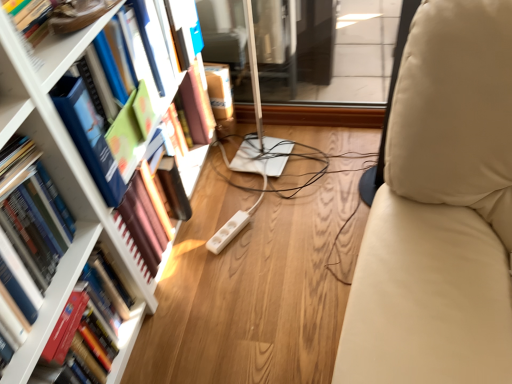
Question: Is white glossy bookshelf at upper left positioned far away from hardcover book at left, positioned as the 1th book in bottom-to-top order?

Choices:
 (A) no
 (B) yes

Answer: (A)

Question: From a real-world perspective, is white glossy bookshelf at upper left physically below hardcover book at left, positioned as the 1th book in bottom-to-top order?

Choices:
 (A) yes
 (B) no

Answer: (B)

Question: Can you confirm if white glossy bookshelf at upper left is shorter than hardcover book at left, the 3th book in the top-to-bottom sequence?

Choices:
 (A) no
 (B) yes

Answer: (B)

Question: Can you confirm if white glossy bookshelf at upper left is wider than hardcover book at left, positioned as the 1th book in bottom-to-top order?

Choices:
 (A) yes
 (B) no

Answer: (B)

Question: Is white glossy bookshelf at upper left facing towards hardcover book at left, the 3th book in the top-to-bottom sequence?

Choices:
 (A) yes
 (B) no

Answer: (B)

Question: Does white glossy bookshelf at upper left appear on the left side of hardcover book at left, positioned as the 1th book in bottom-to-top order?

Choices:
 (A) yes
 (B) no

Answer: (B)

Question: Is hardcover book at left, the first book viewed from the top, bigger than hardcover book at left, arranged as the second book when ordered from the bottom?

Choices:
 (A) no
 (B) yes

Answer: (B)

Question: Does hardcover book at left, the first book viewed from the top, have a lesser width compared to hardcover book at left, arranged as the second book when ordered from the bottom?

Choices:
 (A) no
 (B) yes

Answer: (A)

Question: Considering the relative sizes of hardcover book at left, the first book viewed from the top, and hardcover book at left, which is the second book in top-to-bottom order, in the image provided, is hardcover book at left, the first book viewed from the top, taller than hardcover book at left, which is the second book in top-to-bottom order,?

Choices:
 (A) yes
 (B) no

Answer: (B)

Question: Is hardcover book at left, the first book viewed from the top, oriented away from hardcover book at left, arranged as the second book when ordered from the bottom?

Choices:
 (A) yes
 (B) no

Answer: (B)

Question: From a real-world perspective, is hardcover book at left, the third book from the bottom, located beneath hardcover book at left, which is the second book in top-to-bottom order?

Choices:
 (A) yes
 (B) no

Answer: (B)

Question: Is the depth of hardcover book at left, the third book from the bottom, greater than that of hardcover book at left, which is the second book in top-to-bottom order?

Choices:
 (A) yes
 (B) no

Answer: (A)

Question: Is hardcover book at left, arranged as the second book when ordered from the bottom, wider than white glossy bookshelf at upper left?

Choices:
 (A) no
 (B) yes

Answer: (B)